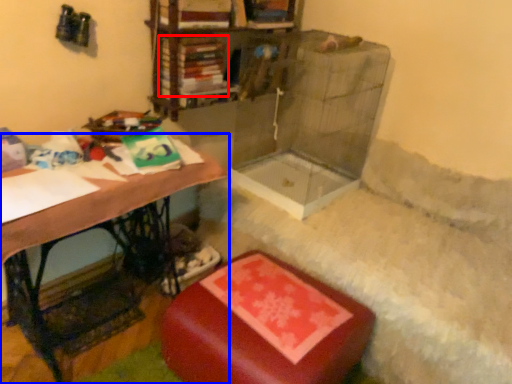
Question: Which of the following is the farthest to the observer, book (highlighted by a red box) or table (highlighted by a blue box)?

Choices:
 (A) book
 (B) table

Answer: (A)